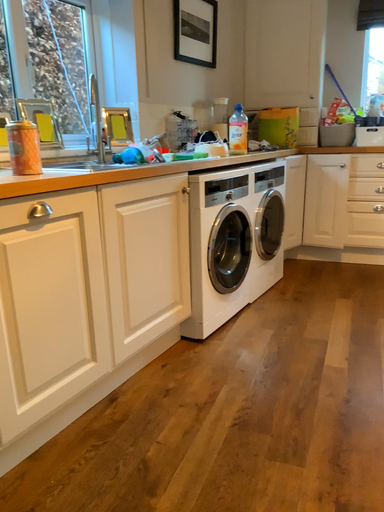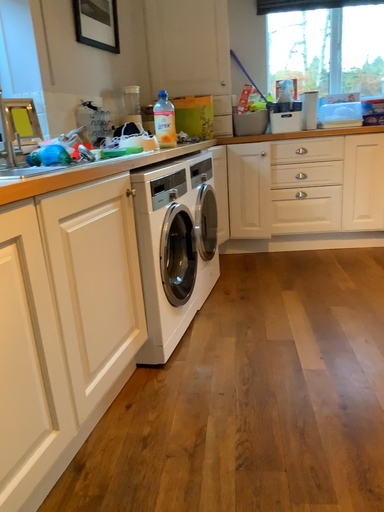
Question: Which way did the camera rotate in the video?

Choices:
 (A) rotated left
 (B) rotated right

Answer: (B)